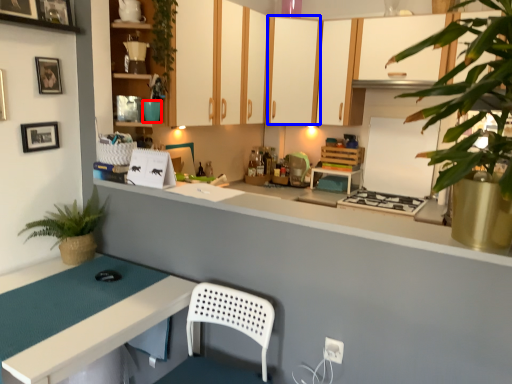
Question: Which object appears closest to the camera in this image, teal (highlighted by a red box) or cabinetry (highlighted by a blue box)?

Choices:
 (A) teal
 (B) cabinetry

Answer: (A)